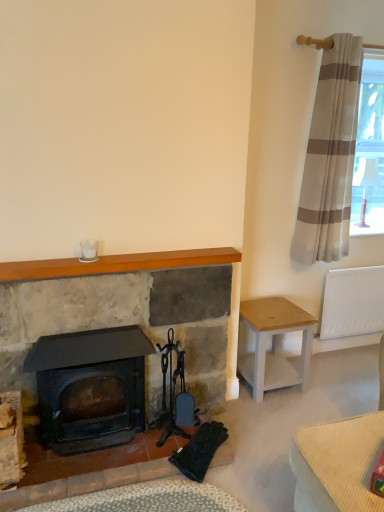
Locate an element on the screen. The image size is (384, 512). blank space to the left of white glass at upper center is located at coordinates (59, 265).